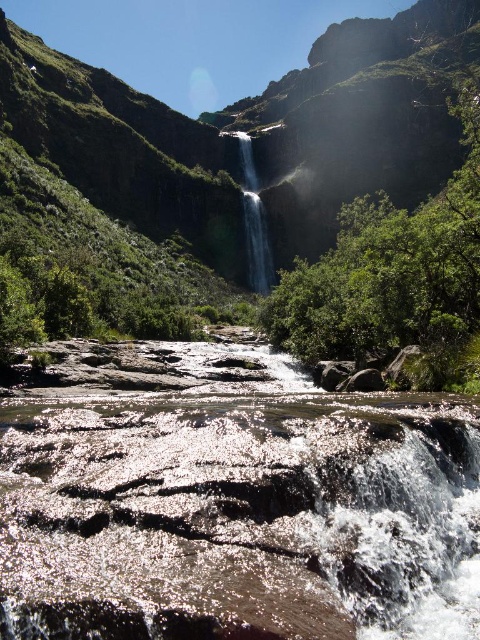
Question: Observing the image, what is the correct spatial positioning of shiny brown rock at center in reference to clear glass waterfall at upper center?

Choices:
 (A) right
 (B) left

Answer: (B)

Question: Can you confirm if shiny brown rock at center is bigger than clear glass waterfall at upper center?

Choices:
 (A) no
 (B) yes

Answer: (A)

Question: Which point is farther to the camera?

Choices:
 (A) (247, 220)
 (B) (201, 616)

Answer: (A)

Question: Observing the image, what is the correct spatial positioning of shiny brown rock at center in reference to green mossy rock at center?

Choices:
 (A) below
 (B) above

Answer: (A)

Question: Which of the following is the farthest from the observer?

Choices:
 (A) shiny brown rock at center
 (B) clear glass waterfall at upper center

Answer: (B)

Question: Which of the following is the closest to the observer?

Choices:
 (A) (364, 122)
 (B) (272, 264)

Answer: (B)